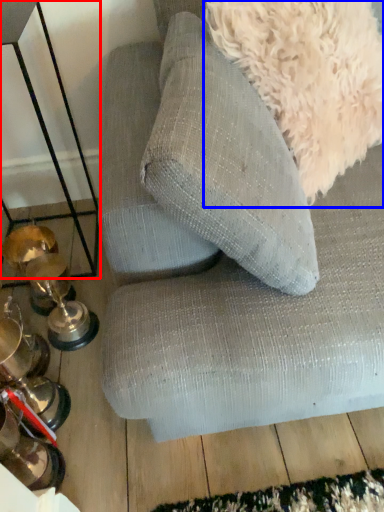
Question: Which object appears farthest to the camera in this image, table (highlighted by a red box) or dog (highlighted by a blue box)?

Choices:
 (A) table
 (B) dog

Answer: (A)